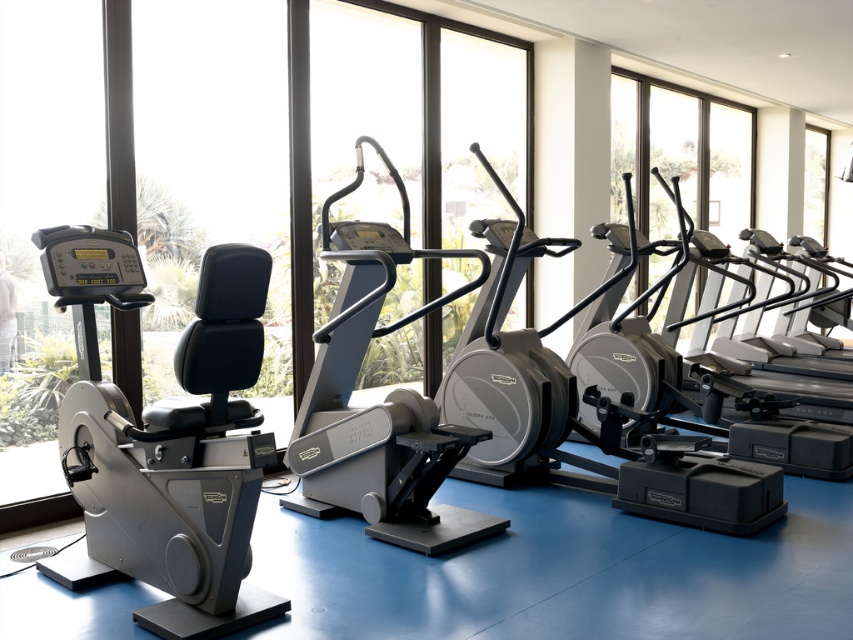
Question: Which point is closer to the camera taking this photo?

Choices:
 (A) (671, 154)
 (B) (239, 358)

Answer: (B)

Question: Which point is farther to the camera?

Choices:
 (A) (706, 156)
 (B) (260, 292)

Answer: (A)

Question: Does matte black exercise bike at left appear over transparent glass windows at upper right?

Choices:
 (A) no
 (B) yes

Answer: (A)

Question: Is matte black exercise bike at left below transparent glass windows at upper right?

Choices:
 (A) yes
 (B) no

Answer: (A)

Question: Which object is closer to the camera taking this photo?

Choices:
 (A) matte black exercise bike at left
 (B) transparent glass windows at upper right

Answer: (A)

Question: Is matte black exercise bike at left wider than transparent glass windows at upper right?

Choices:
 (A) no
 (B) yes

Answer: (A)